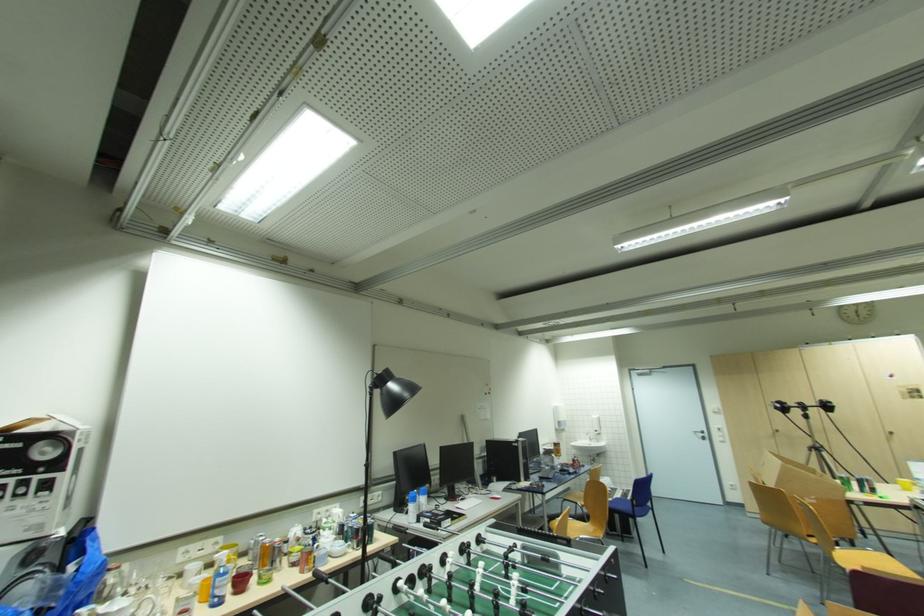
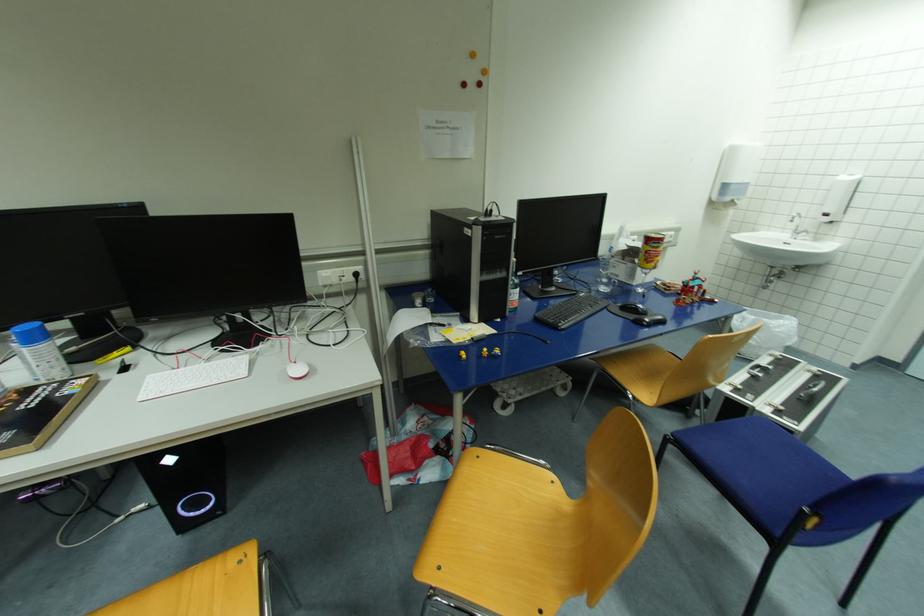
The point at (x=578, y=459) is marked in the first image. Where is the corresponding point in the second image?

(696, 285)